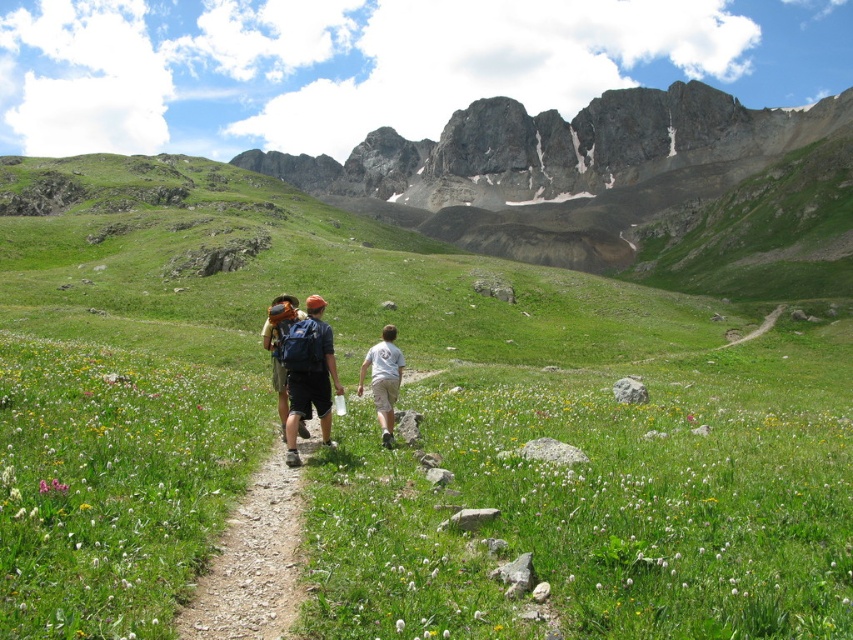
Question: Which point is farther to the camera?

Choices:
 (A) matte brown backpack at center
 (B) dirt/gravel path at center
 (C) matte blue backpack at center

Answer: (A)

Question: Can you confirm if matte blue backpack at center is smaller than white cotton shirt at center?

Choices:
 (A) yes
 (B) no

Answer: (B)

Question: Observing the image, what is the correct spatial positioning of dirt/gravel path at center in reference to matte brown backpack at center?

Choices:
 (A) above
 (B) below

Answer: (B)

Question: Which object appears closest to the camera in this image?

Choices:
 (A) matte brown backpack at center
 (B) matte blue backpack at center
 (C) dirt/gravel path at center
 (D) white cotton shirt at center

Answer: (C)

Question: Among these points, which one is nearest to the camera?

Choices:
 (A) (285, 314)
 (B) (289, 358)
 (C) (381, 387)
 (D) (250, 486)

Answer: (D)

Question: Is white cotton shirt at center positioned in front of matte brown backpack at center?

Choices:
 (A) yes
 (B) no

Answer: (B)